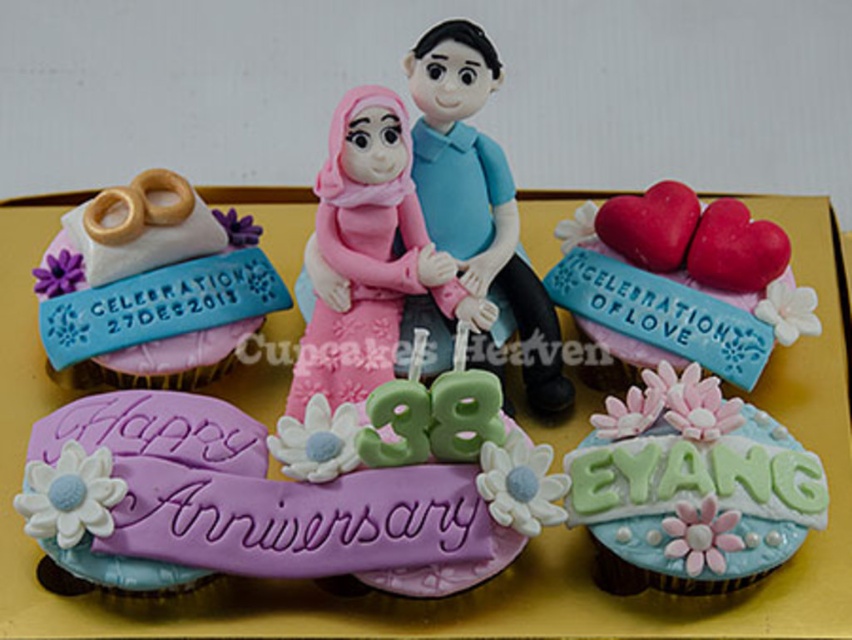
Is pastel blue fondant cupcake with floral decorations at lower right to the left of matte blue plastic couple at center from the viewer's perspective?

In fact, pastel blue fondant cupcake with floral decorations at lower right is to the right of matte blue plastic couple at center.

I want to click on pastel blue fondant cupcake with floral decorations at lower right, so click(691, 486).

Is matte pink fabric doll at center behind matte blue plastic couple at center?

No, it is not.

Who is more distant from viewer, (350,136) or (444,44)?

Positioned behind is point (444,44).

Locate an element on the screen. The image size is (852, 640). matte pink fabric doll at center is located at coordinates (370, 253).

Between smooth pink heart at center and matte pink fabric doll at center, which one is positioned lower?

smooth pink heart at center is below.

Does smooth pink heart at center appear on the right side of matte pink fabric doll at center?

Yes, smooth pink heart at center is to the right of matte pink fabric doll at center.

Describe the element at coordinates (672, 280) in the screenshot. I see `smooth pink heart at center` at that location.

This screenshot has width=852, height=640. Find the location of `smooth pink heart at center`. smooth pink heart at center is located at coordinates (672, 280).